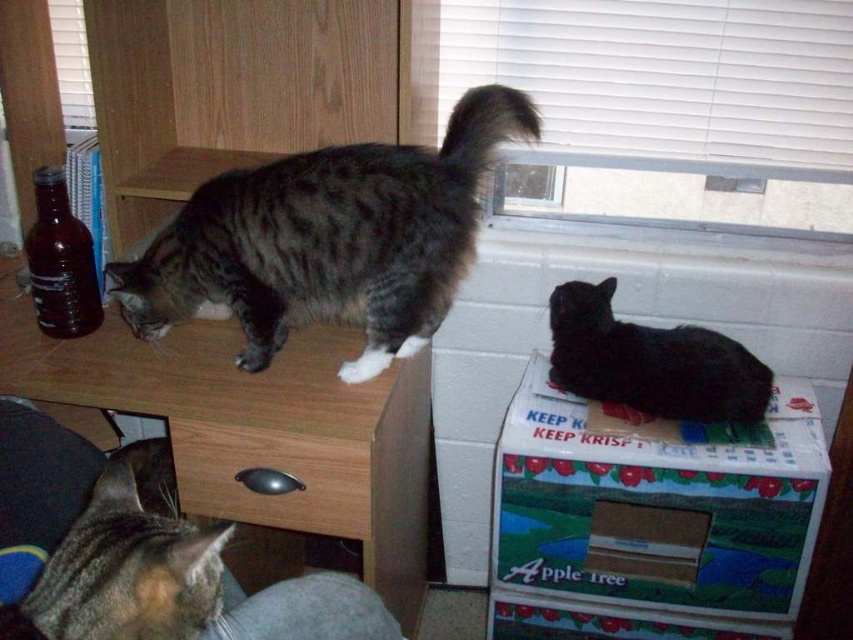
You are a cat owner who wants to place a small toy between the wooden at left and the tabby fur cat at upper left. Can you do this without moving the cat?

The wooden at left is located below the tabby fur cat at upper left, so you can place the toy between them as long as you position it on the lower part near the wooden at left and the upper part near the tabby fur cat at upper left.

You are organizing a cat play area and have a cardboard box at lower right and a brushed metal drawer at lower center. Which object should you place a small cat toy in if the toy requires more space to move around?

The cardboard box at lower right is larger in size than the brushed metal drawer at lower center, so the small cat toy should be placed in the cardboard box at lower right to allow more space for movement.

Consider the image. You are a cat owner who wants to place a small toy between the wooden at left and the tabby fur cat at upper left. Can you fit the toy between them?

The wooden at left is positioned on the left side of tabby fur cat at upper left, so there is space between them to place the toy.